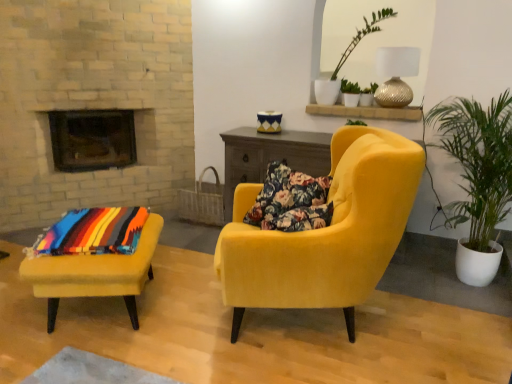
You are a GUI agent. You are given a task and a screenshot of the screen. Output one action in this format:
    pyautogui.click(x=<x>, y=<y>)
    Task: Click on the vacant location below green leafy plant in white pot at right (from a real-world perspective)
    
    Given the screenshot: What is the action you would take?
    pyautogui.click(x=458, y=283)